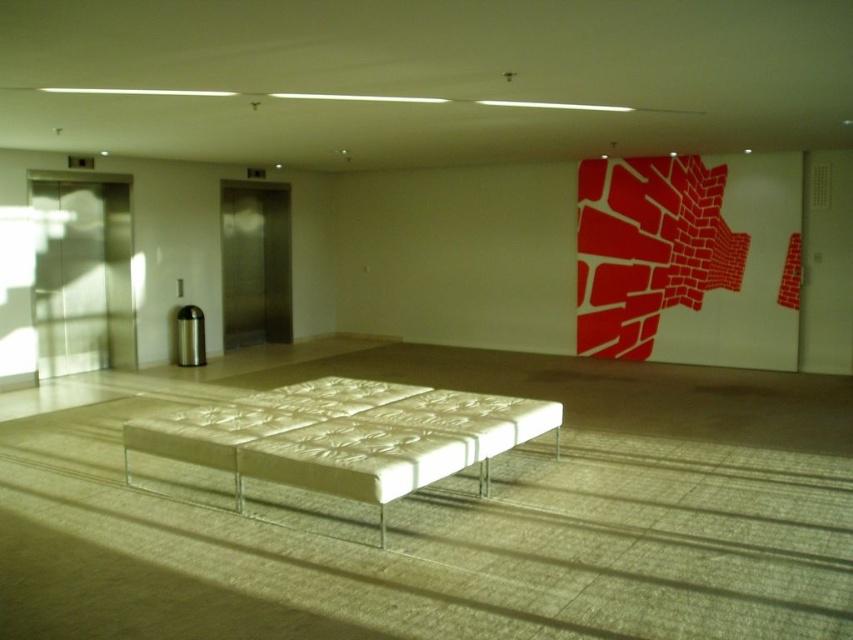
Which is in front, point (276, 394) or point (259, 266)?

Point (276, 394) is in front.

What do you see at coordinates (347, 436) in the screenshot? I see `white textured bench at center` at bounding box center [347, 436].

Measure the distance between white textured bench at center and camera.

white textured bench at center is 3.63 meters away from camera.

Where is `white textured bench at center`? The image size is (853, 640). white textured bench at center is located at coordinates (347, 436).

Who is more forward, (155, 433) or (38, 262)?

Point (155, 433) is in front.

Does white textured bench at center have a greater height compared to polished stainless steel elevator at left?

Incorrect, white textured bench at center's height is not larger of polished stainless steel elevator at left's.

Which is behind, point (367, 394) or point (67, 230)?

Point (67, 230)

Identify the location of white textured bench at center. (347, 436).

Is polished stainless steel elevator at left to the right of stainless steel elevator at left from the viewer's perspective?

In fact, polished stainless steel elevator at left is to the left of stainless steel elevator at left.

Between polished stainless steel elevator at left and stainless steel elevator at left, which one is positioned higher?

stainless steel elevator at left is higher up.

This screenshot has width=853, height=640. Describe the element at coordinates (83, 275) in the screenshot. I see `polished stainless steel elevator at left` at that location.

This screenshot has width=853, height=640. Identify the location of polished stainless steel elevator at left. (83, 275).